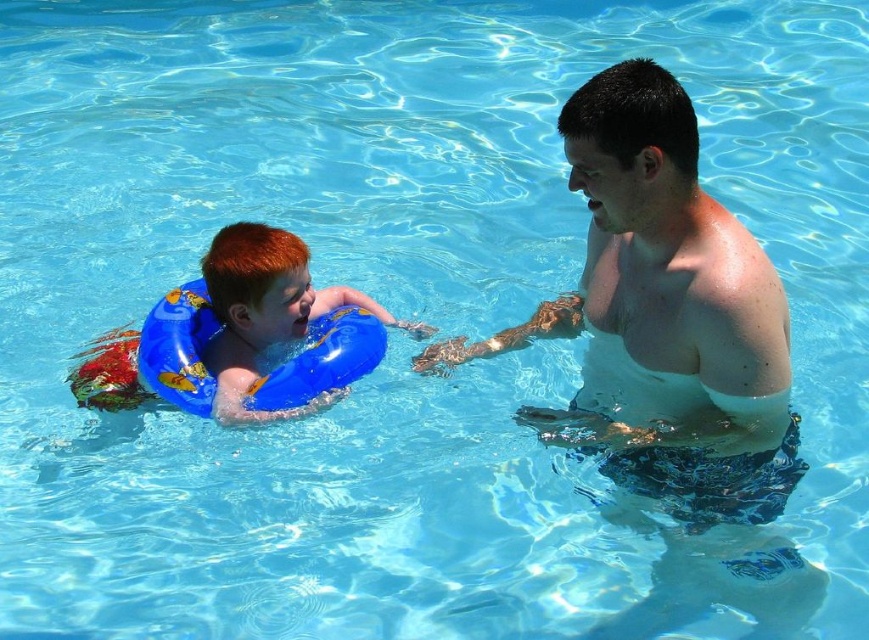
Question: Which point appears closest to the camera in this image?

Choices:
 (A) (257, 253)
 (B) (363, 352)
 (C) (566, 122)

Answer: (C)

Question: Which of these objects is positioned farthest from the blue rubber ring at left?

Choices:
 (A) blue inflatable ring at left
 (B) smooth skin man at center

Answer: (B)

Question: Considering the relative positions of smooth skin man at center and blue inflatable ring at left in the image provided, where is smooth skin man at center located with respect to blue inflatable ring at left?

Choices:
 (A) below
 (B) above

Answer: (A)

Question: Is smooth skin man at center wider than blue rubber ring at left?

Choices:
 (A) yes
 (B) no

Answer: (B)

Question: Which point appears closest to the camera in this image?

Choices:
 (A) (370, 348)
 (B) (711, 308)
 (C) (260, 275)

Answer: (B)

Question: Can you confirm if smooth skin man at center is wider than blue rubber ring at left?

Choices:
 (A) yes
 (B) no

Answer: (B)